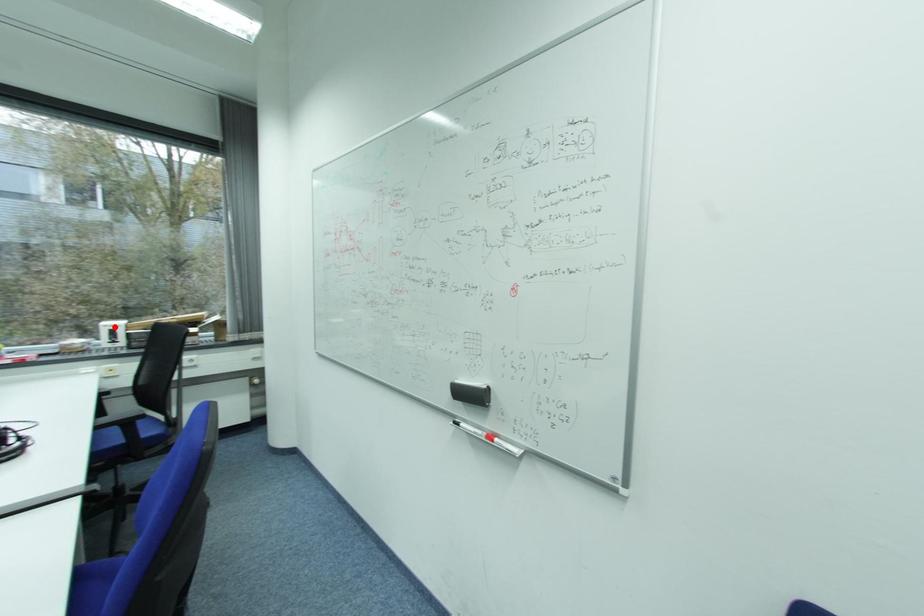
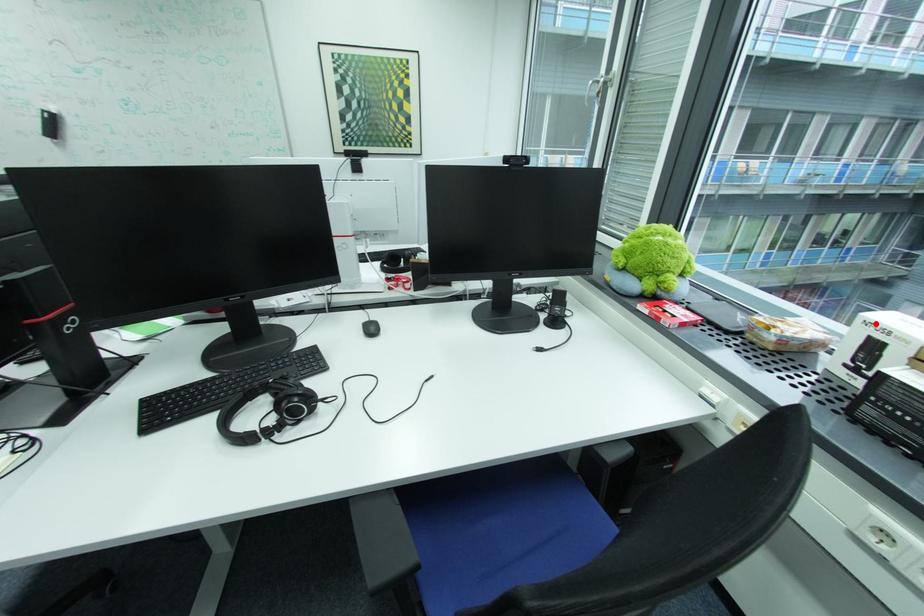
I am providing you with two images of the same scene from different viewpoints. A red point is marked on the first image and another point is marked on the second image. Does the point marked in image1 correspond to the same location as the one in image2?

Yes